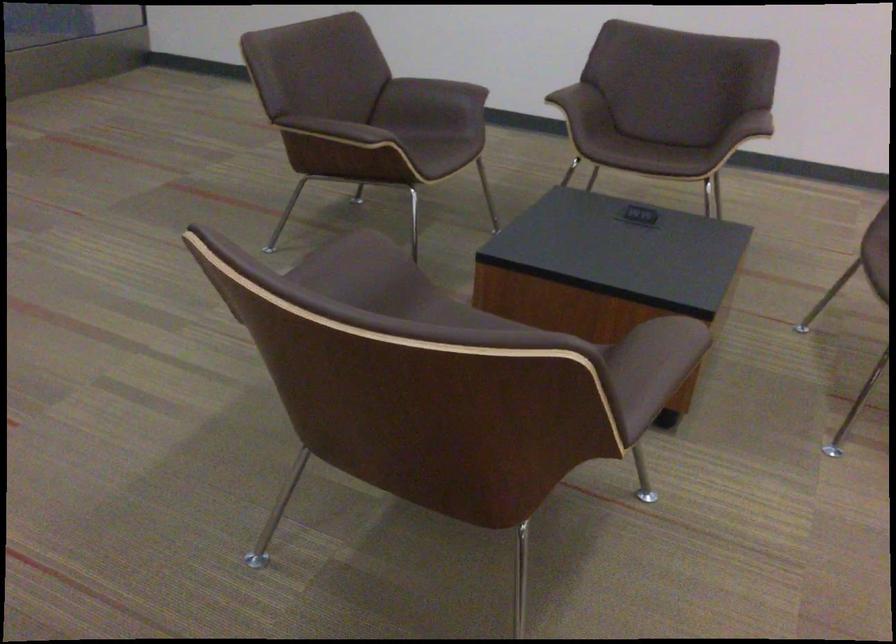
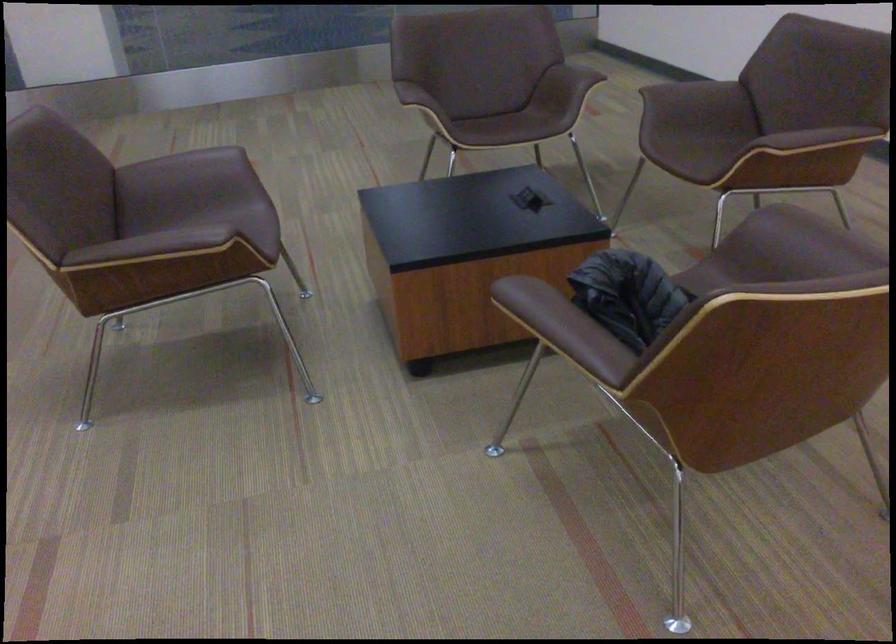
The point at (354, 261) is marked in the first image. Where is the corresponding point in the second image?

(193, 162)